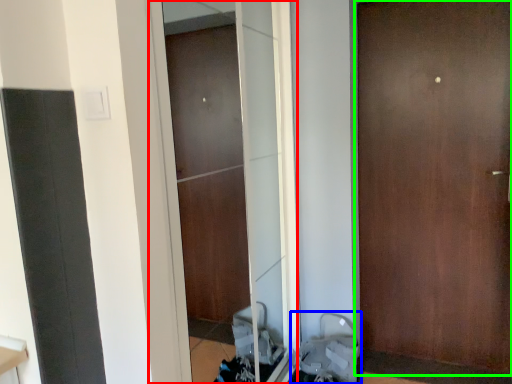
Question: Considering the real-world distances, which object is farthest from screen door (highlighted by a red box)? baby carriage (highlighted by a blue box) or door (highlighted by a green box)?

Choices:
 (A) baby carriage
 (B) door

Answer: (B)